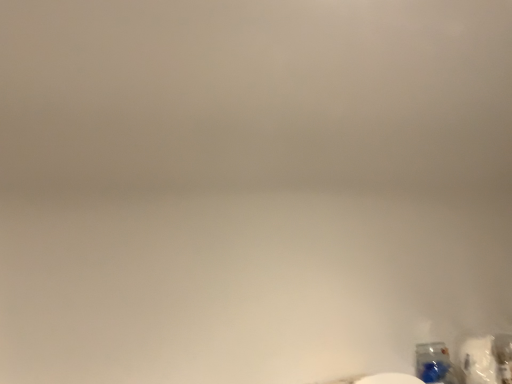
The height and width of the screenshot is (384, 512). Identify the location of translucent plastic bottle at bottom right. (436, 364).

What do you see at coordinates (436, 364) in the screenshot? I see `translucent plastic bottle at bottom right` at bounding box center [436, 364].

The image size is (512, 384). Find the location of `translucent plastic bottle at bottom right`. translucent plastic bottle at bottom right is located at coordinates (436, 364).